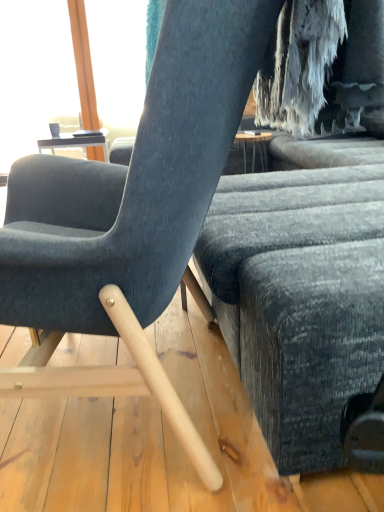
Question: Considering the relative positions of matte black screen at upper left and textured gray fabric couch at center in the image provided, is matte black screen at upper left to the right of textured gray fabric couch at center from the viewer's perspective?

Choices:
 (A) yes
 (B) no

Answer: (B)

Question: Can you confirm if matte black screen at upper left is wider than textured gray fabric couch at center?

Choices:
 (A) no
 (B) yes

Answer: (A)

Question: Is matte black screen at upper left located outside textured gray fabric couch at center?

Choices:
 (A) yes
 (B) no

Answer: (A)

Question: From the image's perspective, does matte black screen at upper left appear lower than textured gray fabric couch at center?

Choices:
 (A) no
 (B) yes

Answer: (A)

Question: Is textured gray fabric couch at center at the back of matte black screen at upper left?

Choices:
 (A) no
 (B) yes

Answer: (A)

Question: Based on their positions, is textured gray fabric couch at center located to the left or right of matte gray chair at center?

Choices:
 (A) left
 (B) right

Answer: (B)

Question: Does point pos(243,210) appear closer or farther from the camera than point pos(92,214)?

Choices:
 (A) closer
 (B) farther

Answer: (A)

Question: In the image, is textured gray fabric couch at center positioned in front of or behind matte gray chair at center?

Choices:
 (A) behind
 (B) front

Answer: (A)

Question: In terms of size, does textured gray fabric couch at center appear bigger or smaller than matte gray chair at center?

Choices:
 (A) small
 (B) big

Answer: (B)

Question: In the image, is matte black screen at upper left positioned in front of or behind matte gray chair at center?

Choices:
 (A) front
 (B) behind

Answer: (B)

Question: In terms of width, does matte black screen at upper left look wider or thinner when compared to matte gray chair at center?

Choices:
 (A) thin
 (B) wide

Answer: (A)

Question: Would you say matte black screen at upper left is inside or outside matte gray chair at center?

Choices:
 (A) outside
 (B) inside

Answer: (A)

Question: Based on their sizes in the image, would you say matte black screen at upper left is bigger or smaller than matte gray chair at center?

Choices:
 (A) small
 (B) big

Answer: (A)

Question: Considering the positions of matte black screen at upper left and textured gray fabric couch at center in the image, is matte black screen at upper left taller or shorter than textured gray fabric couch at center?

Choices:
 (A) short
 (B) tall

Answer: (B)

Question: Visually, is matte black screen at upper left positioned to the left or to the right of textured gray fabric couch at center?

Choices:
 (A) left
 (B) right

Answer: (A)